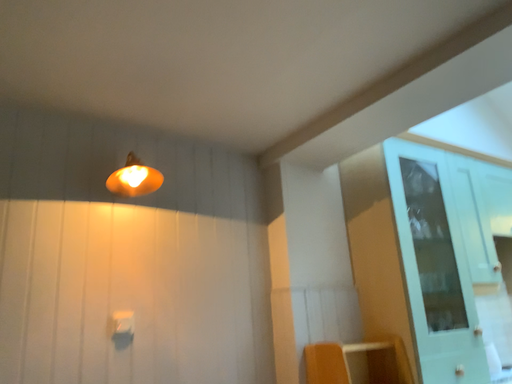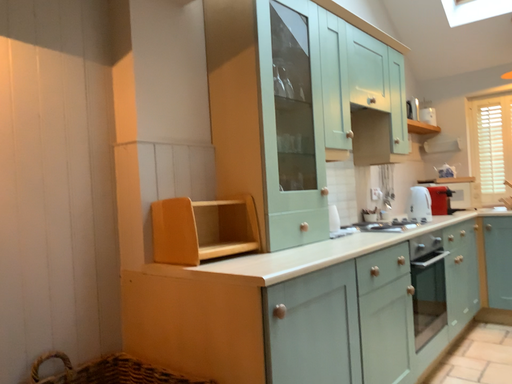
Question: Which way did the camera rotate in the video?

Choices:
 (A) rotated right
 (B) rotated left

Answer: (A)